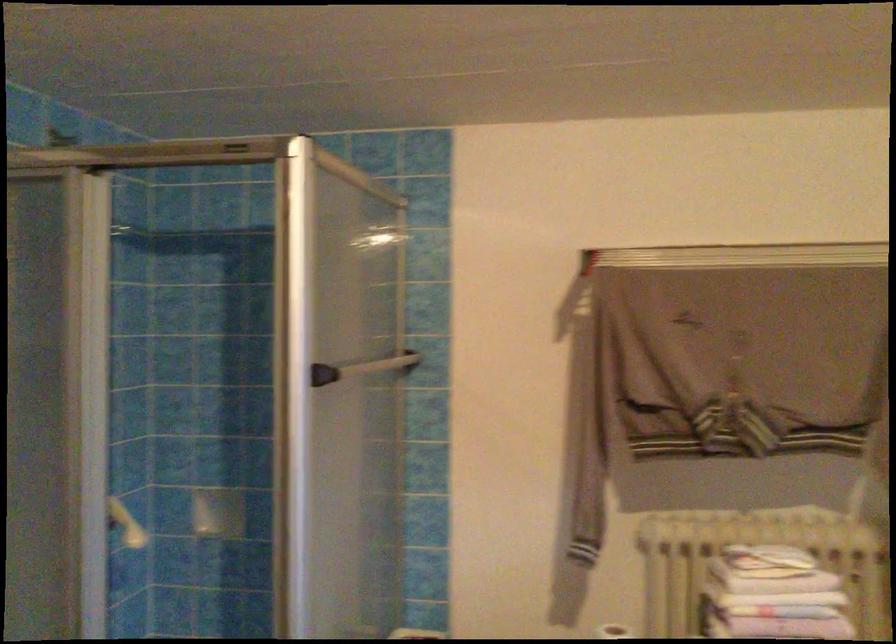
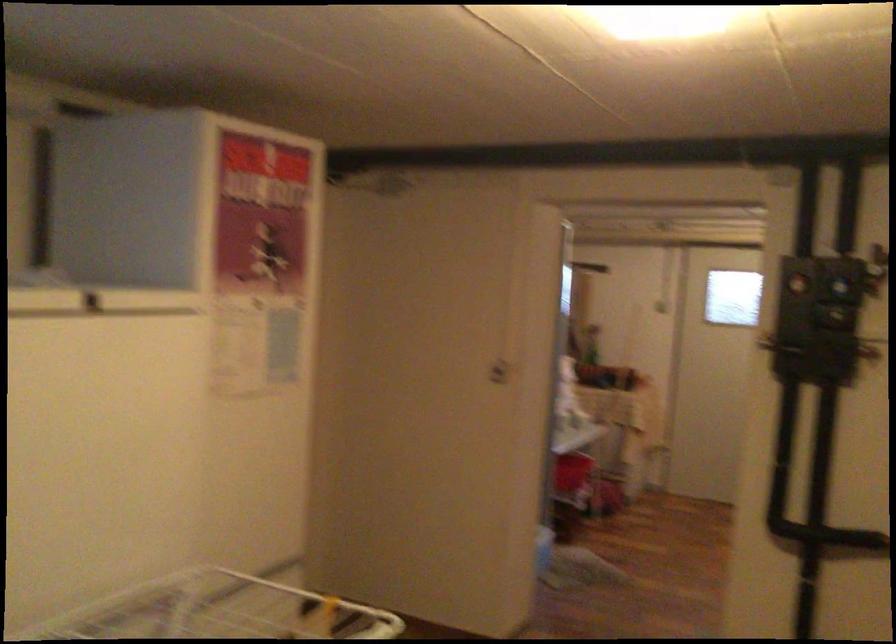
Question: I am providing you with two images of the same scene from different viewpoints. After the viewpoint changes to image2, which objects are now occluded?

Choices:
 (A) shower door handle
 (B) refrigerator door handle
 (C) white door handle
 (D) wooden whiteboard eraser

Answer: (A)